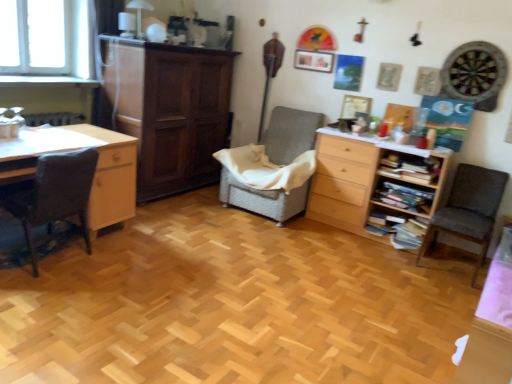
Question: Does wooden bookshelf at right, which is the 1th shelf in bottom-to-top order, lie in front of woven fabric chair at center, positioned as the second chair in right-to-left order?

Choices:
 (A) yes
 (B) no

Answer: (B)

Question: Is wooden bookshelf at right, which is the 1th shelf in bottom-to-top order, to the left of woven fabric chair at center, arranged as the 2th chair when viewed from the left, from the viewer's perspective?

Choices:
 (A) no
 (B) yes

Answer: (A)

Question: Is wooden bookshelf at right, which is the 1th shelf in bottom-to-top order, outside of woven fabric chair at center, arranged as the 2th chair when viewed from the left?

Choices:
 (A) no
 (B) yes

Answer: (B)

Question: Can you confirm if wooden bookshelf at right, which is the 2th shelf in top-to-bottom order, is thinner than woven fabric chair at center, arranged as the 2th chair when viewed from the left?

Choices:
 (A) yes
 (B) no

Answer: (A)

Question: Does wooden bookshelf at right, which is the 2th shelf in top-to-bottom order, have a larger size compared to woven fabric chair at center, arranged as the 2th chair when viewed from the left?

Choices:
 (A) yes
 (B) no

Answer: (B)

Question: Does wooden bookshelf at right, which is the 1th shelf in bottom-to-top order, have a greater height compared to woven fabric chair at center, arranged as the 2th chair when viewed from the left?

Choices:
 (A) yes
 (B) no

Answer: (B)

Question: From a real-world perspective, is light wood chest of drawers at center right on top of wooden bookshelf at right, which is the 2th shelf in top-to-bottom order?

Choices:
 (A) yes
 (B) no

Answer: (A)

Question: Could you tell me if light wood chest of drawers at center right is facing wooden bookshelf at right, which is the 1th shelf in bottom-to-top order?

Choices:
 (A) no
 (B) yes

Answer: (B)

Question: From the image's perspective, is light wood chest of drawers at center right on top of wooden bookshelf at right, which is the 2th shelf in top-to-bottom order?

Choices:
 (A) no
 (B) yes

Answer: (B)

Question: Is light wood chest of drawers at center right wider than wooden bookshelf at right, which is the 1th shelf in bottom-to-top order?

Choices:
 (A) no
 (B) yes

Answer: (B)

Question: Can you confirm if light wood chest of drawers at center right is positioned to the left of wooden bookshelf at right, which is the 1th shelf in bottom-to-top order?

Choices:
 (A) yes
 (B) no

Answer: (A)

Question: Are light wood chest of drawers at center right and wooden bookshelf at right, which is the 1th shelf in bottom-to-top order, beside each other?

Choices:
 (A) yes
 (B) no

Answer: (B)

Question: Is woven fabric chair at center, arranged as the 2th chair when viewed from the left, bigger than wooden bookshelf at right, acting as the 1th shelf starting from the top?

Choices:
 (A) yes
 (B) no

Answer: (A)